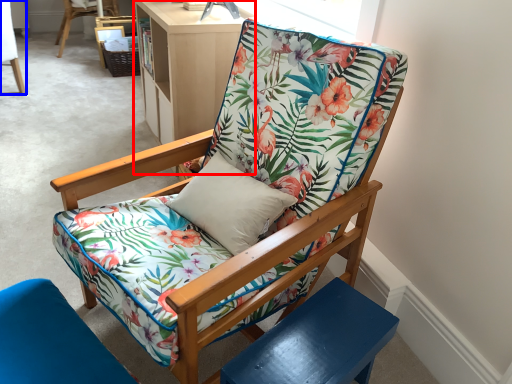
Question: Which object appears farthest to the camera in this image, bookshelf (highlighted by a red box) or chair (highlighted by a blue box)?

Choices:
 (A) bookshelf
 (B) chair

Answer: (B)